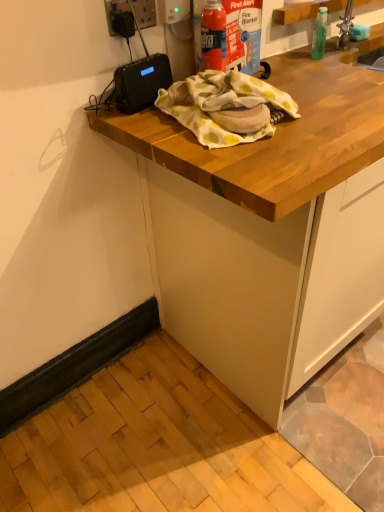
Find the location of a particular element. The image size is (384, 512). wooden countertop at upper center is located at coordinates (267, 229).

Describe the element at coordinates (267, 229) in the screenshot. Image resolution: width=384 pixels, height=512 pixels. I see `wooden countertop at upper center` at that location.

In order to click on black plastic electric outlet at upper left in this screenshot , I will do coord(145,13).

Describe the element at coordinates (145, 13) in the screenshot. This screenshot has height=512, width=384. I see `black plastic electric outlet at upper left` at that location.

Identify the location of wooden countertop at upper center. (267, 229).

Based on the photo, does black plastic electric outlet at upper left appear on the left side of wooden countertop at upper center?

Yes.

Is black plastic electric outlet at upper left positioned in front of wooden countertop at upper center?

No, black plastic electric outlet at upper left is behind wooden countertop at upper center.

Between point (146, 18) and point (208, 251), which one is positioned behind?

Point (208, 251)

From the image's perspective, does black plastic electric outlet at upper left appear higher than wooden countertop at upper center?

Indeed, from the image's perspective, black plastic electric outlet at upper left is shown above wooden countertop at upper center.

From a real-world perspective, who is located higher, black plastic electric outlet at upper left or wooden countertop at upper center?

black plastic electric outlet at upper left.

Considering the relative sizes of black plastic electric outlet at upper left and wooden countertop at upper center in the image provided, is black plastic electric outlet at upper left wider than wooden countertop at upper center?

Incorrect, the width of black plastic electric outlet at upper left does not surpass that of wooden countertop at upper center.

Considering the relative sizes of black plastic electric outlet at upper left and wooden countertop at upper center in the image provided, is black plastic electric outlet at upper left taller than wooden countertop at upper center?

No.

Who is bigger, black plastic electric outlet at upper left or wooden countertop at upper center?

wooden countertop at upper center is bigger.

Is black plastic electric outlet at upper left not within wooden countertop at upper center?

Yes, black plastic electric outlet at upper left is not within wooden countertop at upper center.

Consider the image. Is black plastic electric outlet at upper left touching wooden countertop at upper center?

They are not placed beside each other.

Is black plastic electric outlet at upper left oriented towards wooden countertop at upper center?

No.

Can you tell me how much black plastic electric outlet at upper left and wooden countertop at upper center differ in facing direction?

The angle between the facing direction of black plastic electric outlet at upper left and the facing direction of wooden countertop at upper center is 0.0042 degrees.

Image resolution: width=384 pixels, height=512 pixels. I want to click on electric outlet that appears on the left of wooden countertop at upper center, so click(145, 13).

Considering the positions of objects wooden countertop at upper center and black plastic electric outlet at upper left in the image provided, who is more to the right, wooden countertop at upper center or black plastic electric outlet at upper left?

Positioned to the right is wooden countertop at upper center.

Which object is closer to the camera, wooden countertop at upper center or black plastic electric outlet at upper left?

wooden countertop at upper center is closer to the camera.

Which is behind, point (365, 277) or point (138, 0)?

The point (365, 277) is farther.

From the picture: From the image's perspective, which object appears higher, wooden countertop at upper center or black plastic electric outlet at upper left?

From the image's view, black plastic electric outlet at upper left is above.

From a real-world perspective, is wooden countertop at upper center located higher than black plastic electric outlet at upper left?

No, from a real-world perspective, wooden countertop at upper center is not above black plastic electric outlet at upper left.

Is wooden countertop at upper center wider than black plastic electric outlet at upper left?

Indeed, wooden countertop at upper center has a greater width compared to black plastic electric outlet at upper left.

Is wooden countertop at upper center taller or shorter than black plastic electric outlet at upper left?

Considering their sizes, wooden countertop at upper center has more height than black plastic electric outlet at upper left.

Consider the image. Who is bigger, wooden countertop at upper center or black plastic electric outlet at upper left?

wooden countertop at upper center is bigger.

Is black plastic electric outlet at upper left inside wooden countertop at upper center?

No.

Is the surface of wooden countertop at upper center in direct contact with black plastic electric outlet at upper left?

There is a gap between wooden countertop at upper center and black plastic electric outlet at upper left.

Is wooden countertop at upper center facing towards black plastic electric outlet at upper left?

No, wooden countertop at upper center is not turned towards black plastic electric outlet at upper left.

Can you tell me how much wooden countertop at upper center and black plastic electric outlet at upper left differ in facing direction?

There is a 0.0042-degree angle between the facing directions of wooden countertop at upper center and black plastic electric outlet at upper left.

Could you measure the distance between wooden countertop at upper center and black plastic electric outlet at upper left?

wooden countertop at upper center and black plastic electric outlet at upper left are 27.78 inches apart from each other.

The width and height of the screenshot is (384, 512). Identify the location of electric outlet on the left of wooden countertop at upper center. (145, 13).

Find the location of a particular element. This screenshot has height=512, width=384. electric outlet located above the wooden countertop at upper center (from a real-world perspective) is located at coordinates (145, 13).

This screenshot has width=384, height=512. Identify the location of cabinetry in front of the black plastic electric outlet at upper left. (267, 229).